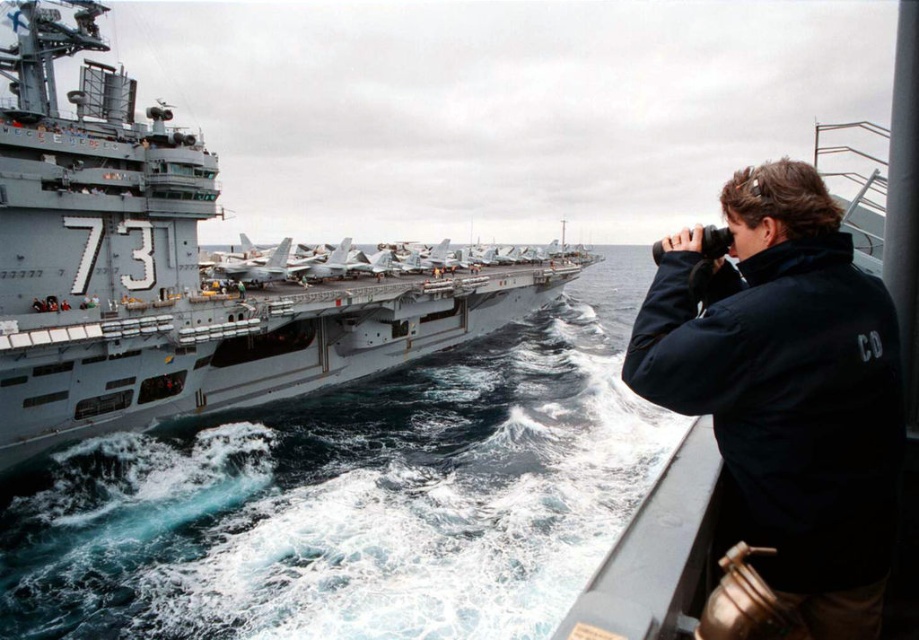
Question: Is blue water at lower left closer to camera compared to black softshell jacket at right?

Choices:
 (A) no
 (B) yes

Answer: (A)

Question: Does gray metallic aircraft carrier at center have a lesser width compared to black softshell jacket at right?

Choices:
 (A) yes
 (B) no

Answer: (B)

Question: Based on their relative distances, which object is nearer to the black softshell jacket at right?

Choices:
 (A) blue water at lower left
 (B) gray metallic aircraft carrier at center

Answer: (A)

Question: Which is nearer to the black softshell jacket at right?

Choices:
 (A) blue water at lower left
 (B) gray metallic aircraft carrier at center

Answer: (A)

Question: Can you confirm if blue water at lower left is positioned above gray metallic aircraft carrier at center?

Choices:
 (A) yes
 (B) no

Answer: (B)

Question: Which of the following is the farthest from the observer?

Choices:
 (A) black softshell jacket at right
 (B) blue water at lower left

Answer: (B)